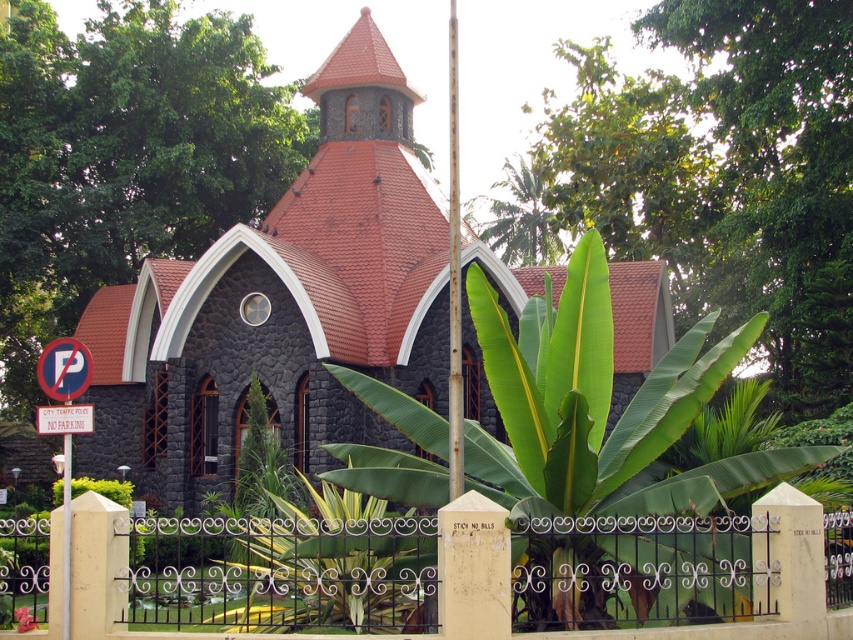
Based on the photo, can you confirm if dark gray stone church at center is positioned above smooth white flag pole at center?

Correct, dark gray stone church at center is located above smooth white flag pole at center.

Who is taller, dark gray stone church at center or smooth white flag pole at center?

smooth white flag pole at center is taller.

Is point (306, 228) less distant than point (457, 257)?

That is False.

Identify the location of dark gray stone church at center. (283, 301).

Is point (477, 509) less distant than point (462, 390)?

That is True.

Who is more distant from viewer, (498, 586) or (454, 22)?

Point (454, 22)

Between point (450, 554) and point (451, 477), which one is positioned in front?

Positioned in front is point (450, 554).

The width and height of the screenshot is (853, 640). What are the coordinates of `iron/textured fence at center` in the screenshot? It's located at (473, 568).

Who is lower down, dark gray stone church at center or iron/textured fence at center?

iron/textured fence at center

Is dark gray stone church at center shorter than iron/textured fence at center?

Incorrect, dark gray stone church at center's height does not fall short of iron/textured fence at center's.

Between point (355, 275) and point (99, 621), which one is positioned in front?

Point (99, 621) is more forward.

The width and height of the screenshot is (853, 640). Find the location of `dark gray stone church at center`. dark gray stone church at center is located at coordinates (283, 301).